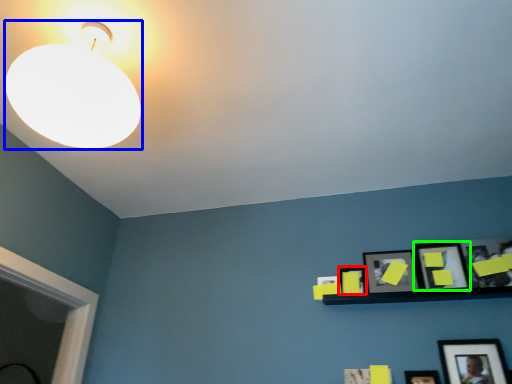
Question: Which object is the closest to the picture frame (highlighted by a red box)? Choose among these: lamp (highlighted by a blue box) or picture frame (highlighted by a green box).

Choices:
 (A) lamp
 (B) picture frame

Answer: (B)